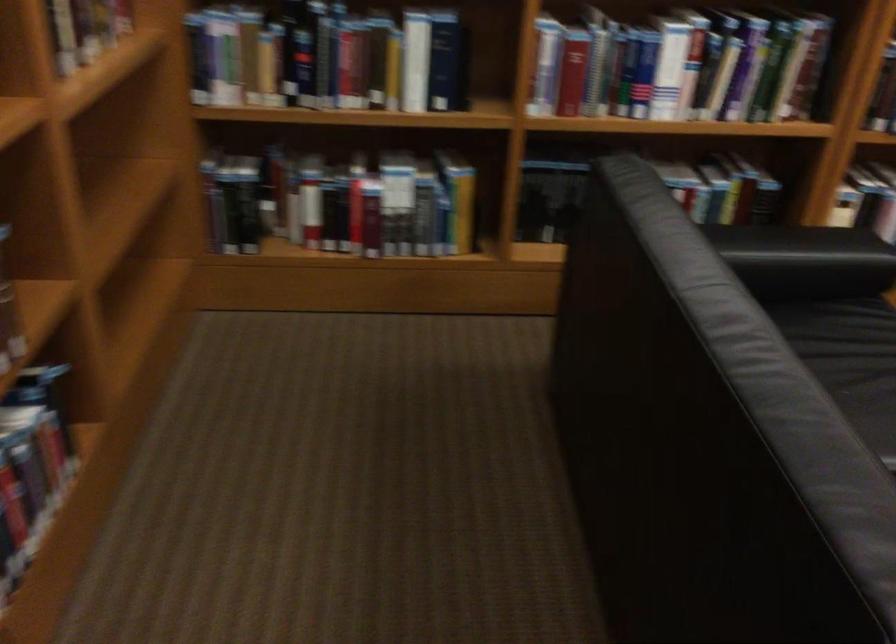
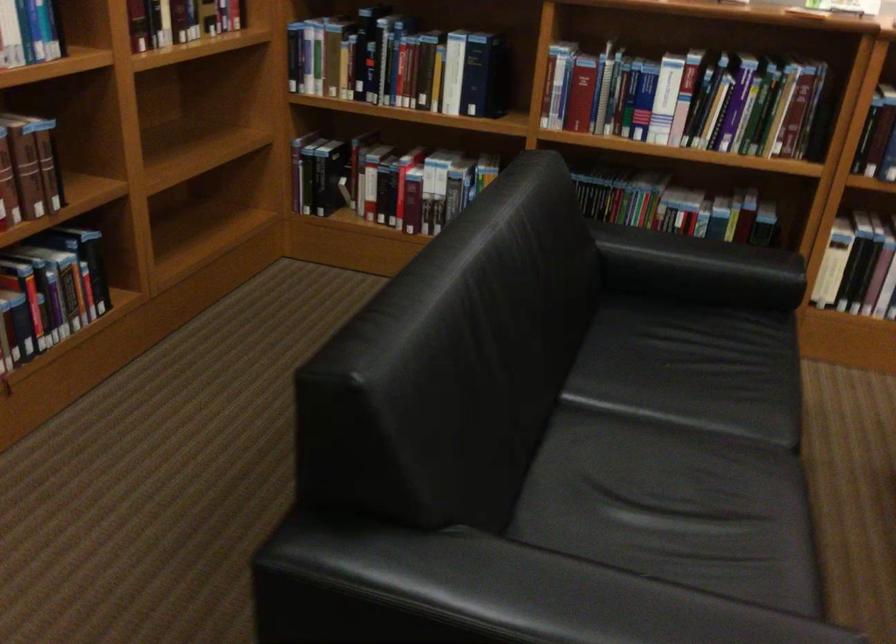
In the second image, find the point that corresponds to (x=794, y=261) in the first image.

(698, 269)